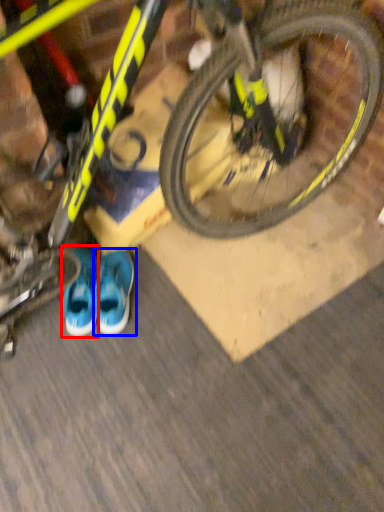
Question: Which object appears farthest to the camera in this image, footwear (highlighted by a red box) or running shoe (highlighted by a blue box)?

Choices:
 (A) footwear
 (B) running shoe

Answer: (A)